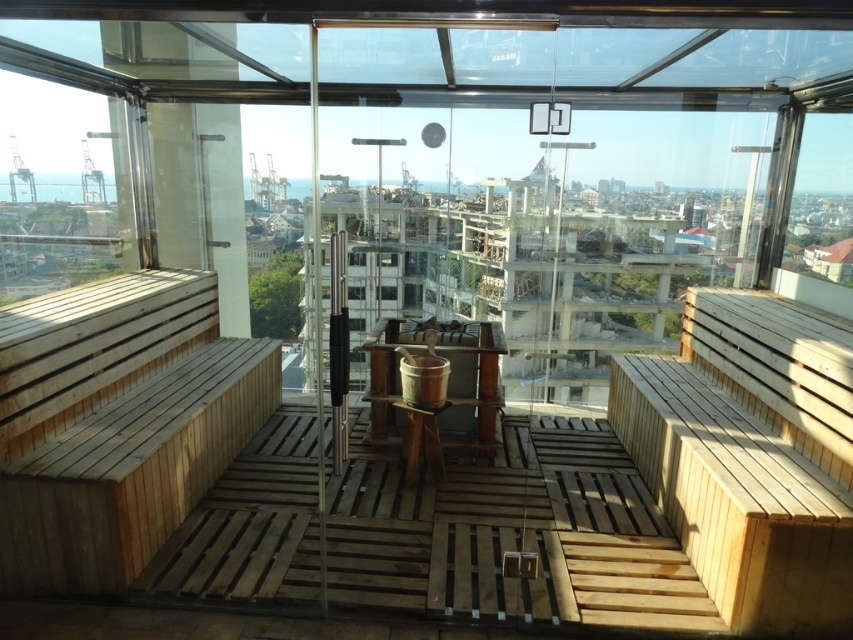
Between natural wood bench at right and transparent glass window at left, which one is positioned higher?

transparent glass window at left is above.

What do you see at coordinates (751, 456) in the screenshot? I see `natural wood bench at right` at bounding box center [751, 456].

Where is `natural wood bench at right`? The image size is (853, 640). natural wood bench at right is located at coordinates (751, 456).

At what (x,y) coordinates should I click in order to perform the action: click on natural wood bench at right. Please return your answer as a coordinate pair (x, y). Looking at the image, I should click on (751, 456).

Is point (22, 371) positioned before point (776, 609)?

No, (22, 371) is further to viewer.

The height and width of the screenshot is (640, 853). I want to click on light brown wooden bench at left, so click(x=115, y=422).

Looking at this image, is light brown wooden bench at left taller than transparent glass window at left?

In fact, light brown wooden bench at left may be shorter than transparent glass window at left.

Who is more distant from viewer, (129,365) or (39,272)?

The point (39,272) is behind.

Who is more forward, (45, 404) or (83, 276)?

Point (45, 404) is more forward.

Image resolution: width=853 pixels, height=640 pixels. Find the location of `light brown wooden bench at left`. light brown wooden bench at left is located at coordinates (115, 422).